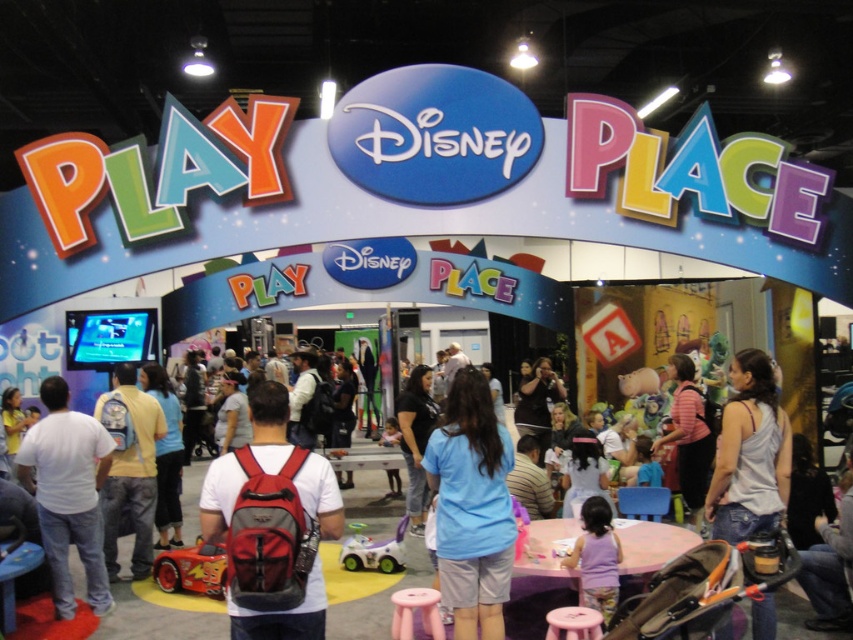
You are at the Disney Play Place event and see a red mesh backpack at center and a gray cotton tank top at right. Which item takes up more space?

The red mesh backpack at center is larger in size than the gray cotton tank top at right, so it takes up more space.